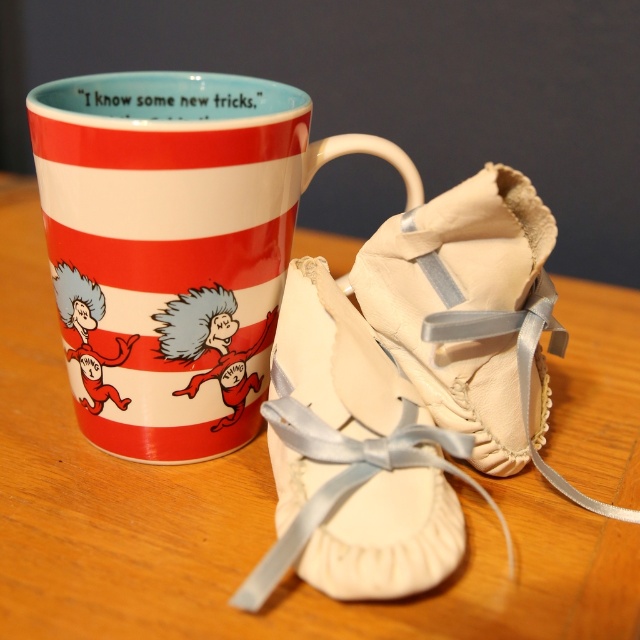
How far apart are wooden table at center and beige leather ballet shoes at center?

The distance of wooden table at center from beige leather ballet shoes at center is 9.22 inches.

What do you see at coordinates (240, 520) in the screenshot?
I see `wooden table at center` at bounding box center [240, 520].

The height and width of the screenshot is (640, 640). Find the location of `wooden table at center`. wooden table at center is located at coordinates (240, 520).

How distant is white satin ballet shoes at center from beige leather ballet shoes at center?

They are 6.24 inches apart.

Is white satin ballet shoes at center positioned before beige leather ballet shoes at center?

Yes, white satin ballet shoes at center is closer to the viewer.

Is point (321, 506) positioned after point (502, 468)?

No.

Locate an element on the screen. The height and width of the screenshot is (640, 640). white satin ballet shoes at center is located at coordinates (349, 458).

Can you confirm if wooden table at center is positioned to the right of white satin ballet shoes at center?

No, wooden table at center is not to the right of white satin ballet shoes at center.

Does point (596, 609) come farther from viewer compared to point (284, 412)?

No, it is not.

Find the location of a particular element. wooden table at center is located at coordinates (240, 520).